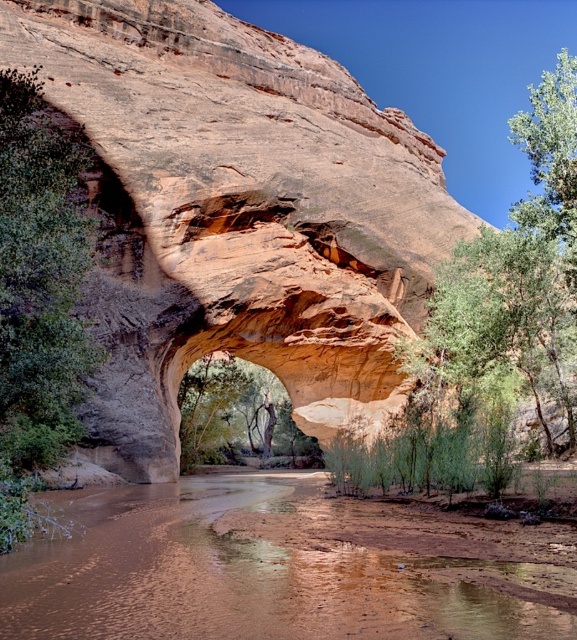
Which is behind, point (213, 493) or point (18, 289)?

The point (213, 493) is more distant.

Which is more to the left, brown sedimentary river at lower center or green leafy tree at left?

Result: green leafy tree at left is more to the left.

Locate an element on the screen. brown sedimentary river at lower center is located at coordinates (234, 577).